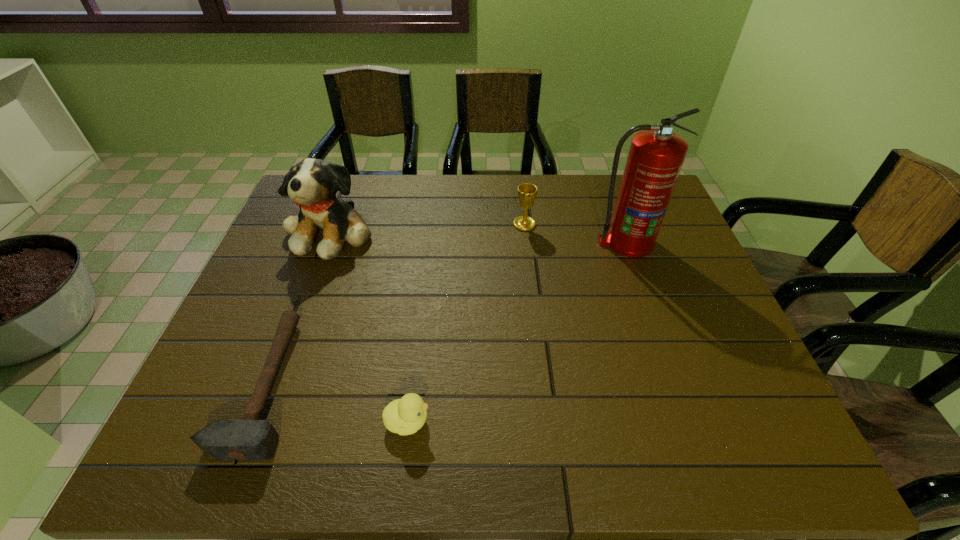
Where is `free spot between the shortest object and the tallest object`? The image size is (960, 540). free spot between the shortest object and the tallest object is located at coordinates (446, 314).

Where is `free space between the fire extinguisher and the puppy`? The image size is (960, 540). free space between the fire extinguisher and the puppy is located at coordinates (479, 237).

The image size is (960, 540). I want to click on free space between the third object from left to right and the second object from right to left, so click(x=466, y=323).

I want to click on free point between the third object from right to left and the rightmost object, so click(x=516, y=332).

Where is `empty space that is in between the third object from right to left and the chalice`? The width and height of the screenshot is (960, 540). empty space that is in between the third object from right to left and the chalice is located at coordinates (466, 323).

Identify the location of free space between the second tallest object and the tallest object. This screenshot has height=540, width=960. (479, 237).

Select which object appears as the fourth closest to the shortest object. Please provide its 2D coordinates. Your answer should be formatted as a tuple, i.e. [(x, y)], where the tuple contains the x and y coordinates of a point satisfying the conditions above.

[(656, 155)]

Locate which object ranks in proximity to the fire extinguisher. Please provide its 2D coordinates. Your answer should be formatted as a tuple, i.e. [(x, y)], where the tuple contains the x and y coordinates of a point satisfying the conditions above.

[(526, 192)]

The height and width of the screenshot is (540, 960). What are the coordinates of `vacant space that satisfies the following two spatial constraints: 1. on the instruction side of the rightmost object; 2. at the beak of the duckling` in the screenshot? It's located at (690, 421).

This screenshot has width=960, height=540. I want to click on free point that satisfies the following two spatial constraints: 1. on the instruction side of the rightmost object; 2. at the beak of the fourth tallest object, so click(x=690, y=421).